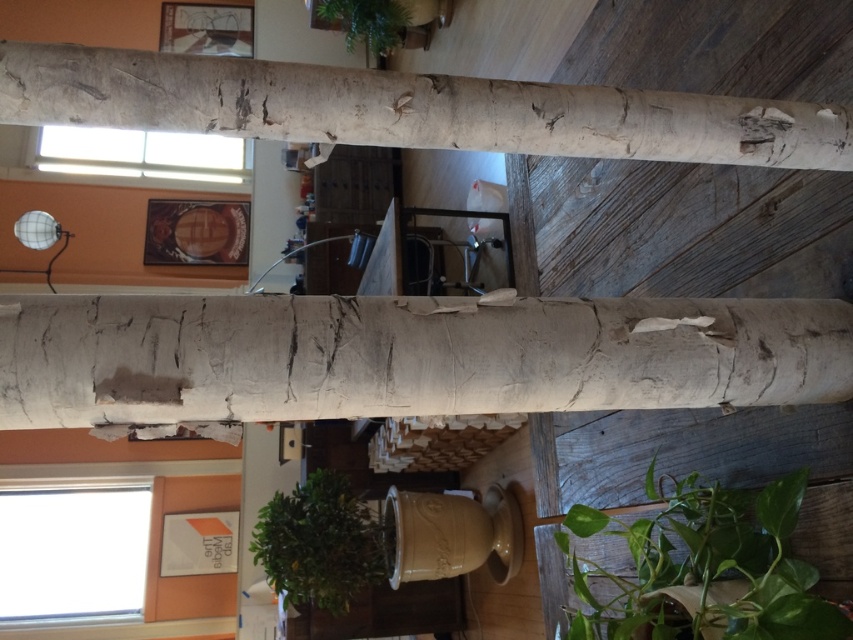
You are standing in the rustic interior space and notice a specific point marked at coordinates (405, 356). What object is located at that point?

The point at coordinates (405, 356) indicates white rough bark at center.

Consider the image. You are an interior designer assessing the space. You need to place a decorative item that is 1 meter wide. The white rough wood beam at upper center and the green matte plant at lower right are in the way. Which object might block the placement of your item due to its size?

The white rough wood beam at upper center has a larger width than the green matte plant at lower right, so the beam is more likely to block the placement of the 1 meter wide decorative item due to its greater width.

You are an interior designer planning to hang a small painting between the white rough wood beam at upper center and the green matte plant at lower right. Which object should you consider for positioning the painting closer to?

The white rough wood beam at upper center is above the green matte plant at lower right, so to hang the painting between them, position it closer to the white rough wood beam at upper center to maintain balance and avoid obstruction from the plant below.